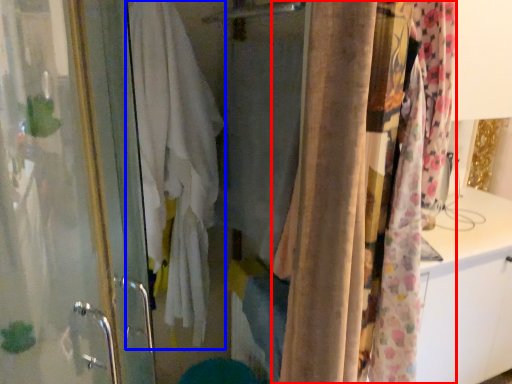
Question: Which object appears farthest to the camera in this image, curtain (highlighted by a red box) or bath towel (highlighted by a blue box)?

Choices:
 (A) curtain
 (B) bath towel

Answer: (B)